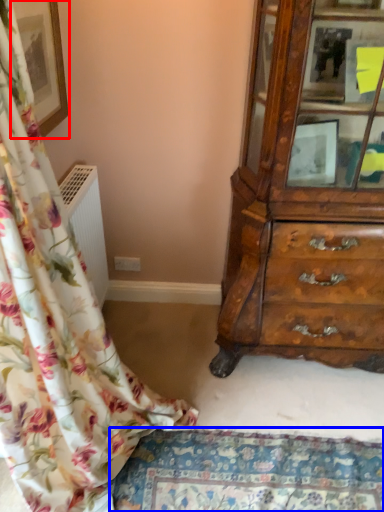
Question: Which object appears farthest to the camera in this image, picture frame (highlighted by a red box) or mat (highlighted by a blue box)?

Choices:
 (A) picture frame
 (B) mat

Answer: (B)